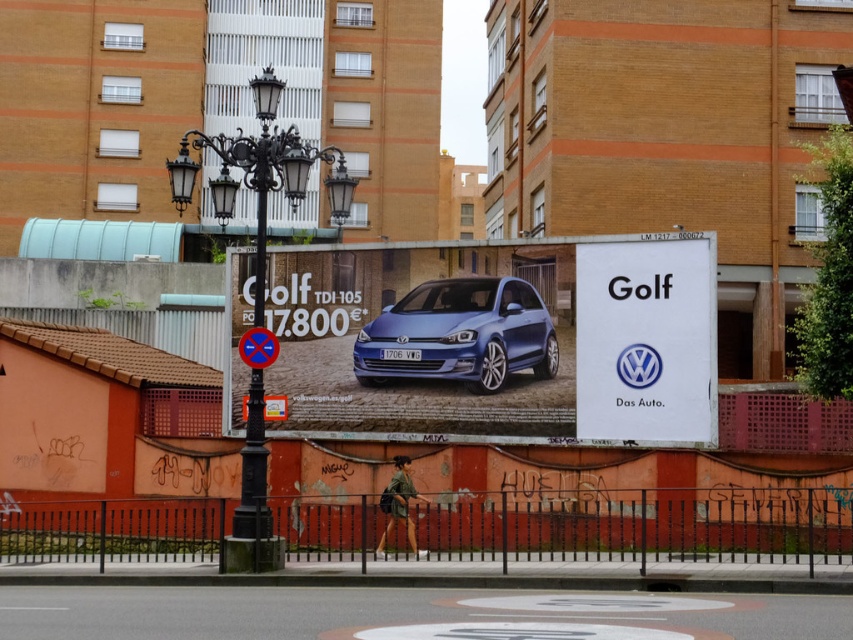
Does white paperboard at center appear on the right side of metallic reflective no parking sign at center?

Correct, you'll find white paperboard at center to the right of metallic reflective no parking sign at center.

Between point (691, 394) and point (271, 358), which one is positioned in front?

Point (271, 358) is more forward.

Identify the location of white paperboard at center. This screenshot has width=853, height=640. (646, 340).

Is satin blue car at center positioned in front of metallic reflective no parking sign at center?

No, satin blue car at center is behind metallic reflective no parking sign at center.

Can you confirm if satin blue car at center is positioned above metallic reflective no parking sign at center?

Correct, satin blue car at center is located above metallic reflective no parking sign at center.

Where is `satin blue car at center`? satin blue car at center is located at coordinates (459, 333).

The width and height of the screenshot is (853, 640). In order to click on satin blue car at center in this screenshot , I will do `click(459, 333)`.

Between black wrought iron lamp post at center and metallic reflective no parking sign at center, which one is positioned higher?

Positioned higher is metallic reflective no parking sign at center.

Locate an element on the screen. black wrought iron lamp post at center is located at coordinates coord(260,172).

Who is more forward, (253, 472) or (254, 339)?

Point (253, 472) is in front.

The height and width of the screenshot is (640, 853). In order to click on black wrought iron lamp post at center in this screenshot , I will do `click(260, 172)`.